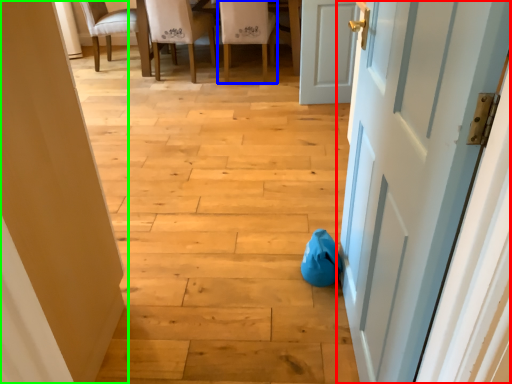
Question: Estimate the real-world distances between objects in this image. Which object is closer to door (highlighted by a red box), chair (highlighted by a blue box) or door (highlighted by a green box)?

Choices:
 (A) chair
 (B) door

Answer: (B)